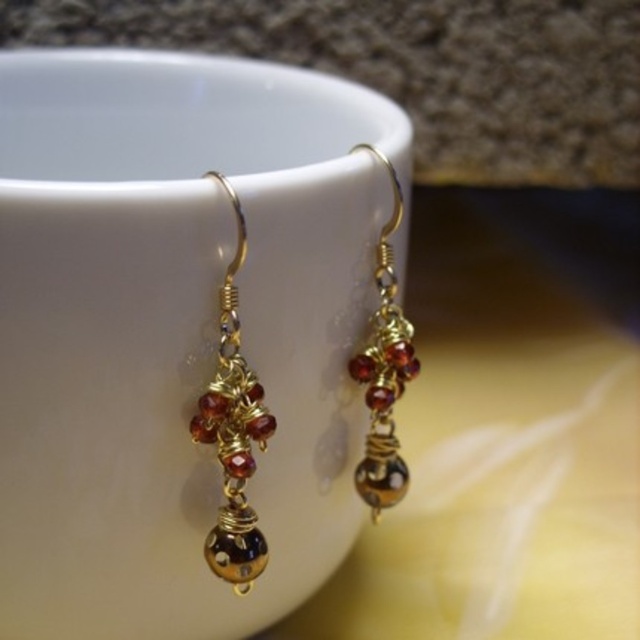
Question: Considering the relative positions of white ceramic mug at upper center and gold wire wrapped earrings at center in the image provided, where is white ceramic mug at upper center located with respect to gold wire wrapped earrings at center?

Choices:
 (A) left
 (B) right

Answer: (A)

Question: Is white ceramic mug at upper center to the right of gold wire wrapped earrings at center from the viewer's perspective?

Choices:
 (A) yes
 (B) no

Answer: (B)

Question: Which object appears closest to the camera in this image?

Choices:
 (A) gold wire wrapped earrings at center
 (B) white ceramic mug at upper center

Answer: (B)

Question: Which of the following is the closest to the observer?

Choices:
 (A) (234, 301)
 (B) (353, 369)
 (C) (310, 212)

Answer: (A)

Question: Which object is positioned closest to the white ceramic mug at upper center?

Choices:
 (A) gold wire wrapped earrings at left
 (B) gold wire wrapped earrings at center

Answer: (B)

Question: In this image, where is white ceramic mug at upper center located relative to gold wire wrapped earrings at center?

Choices:
 (A) left
 (B) right

Answer: (A)